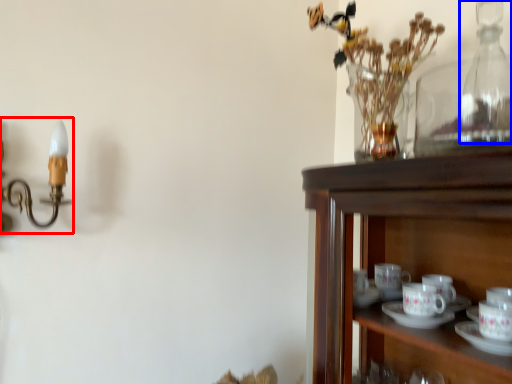
Question: Among these objects, which one is farthest to the camera, candle holder (highlighted by a red box) or bottle (highlighted by a blue box)?

Choices:
 (A) candle holder
 (B) bottle

Answer: (B)